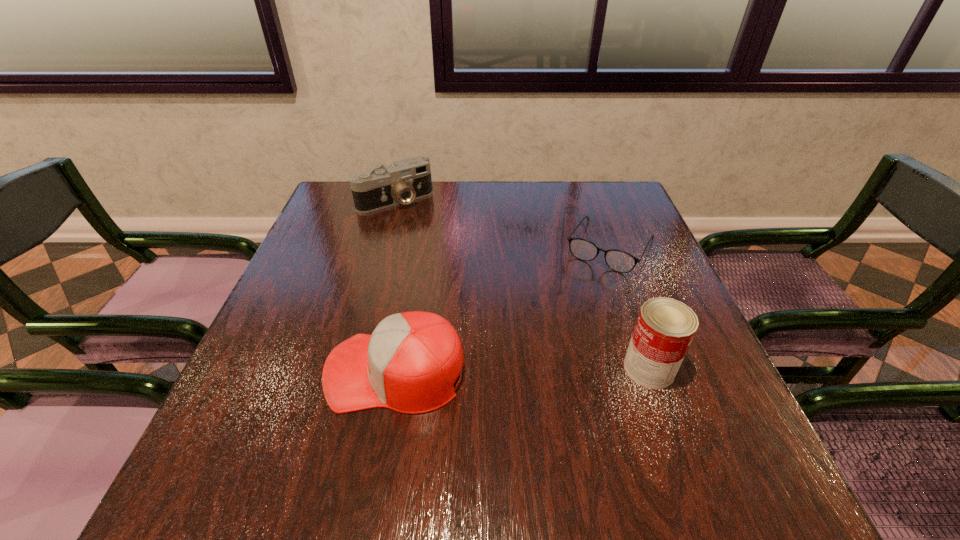
The width and height of the screenshot is (960, 540). In order to click on free point between the tallest object and the baseball cap in this screenshot , I will do `click(522, 370)`.

The image size is (960, 540). I want to click on the third closest object to the spectacles, so click(406, 180).

Select which object is the second closest to the farthest object. Please provide its 2D coordinates. Your answer should be formatted as a tuple, i.e. [(x, y)], where the tuple contains the x and y coordinates of a point satisfying the conditions above.

[(409, 364)]